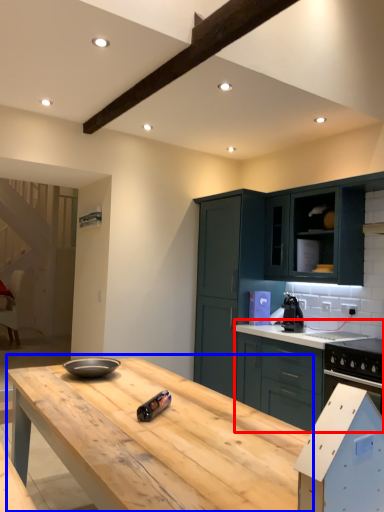
Question: Which object is further to the camera taking this photo, cabinetry (highlighted by a red box) or table (highlighted by a blue box)?

Choices:
 (A) cabinetry
 (B) table

Answer: (A)